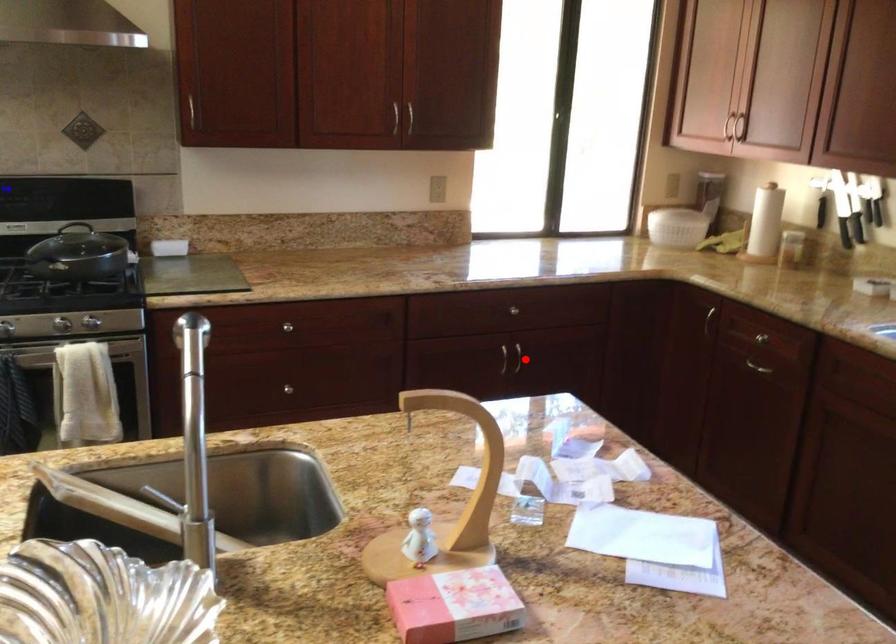
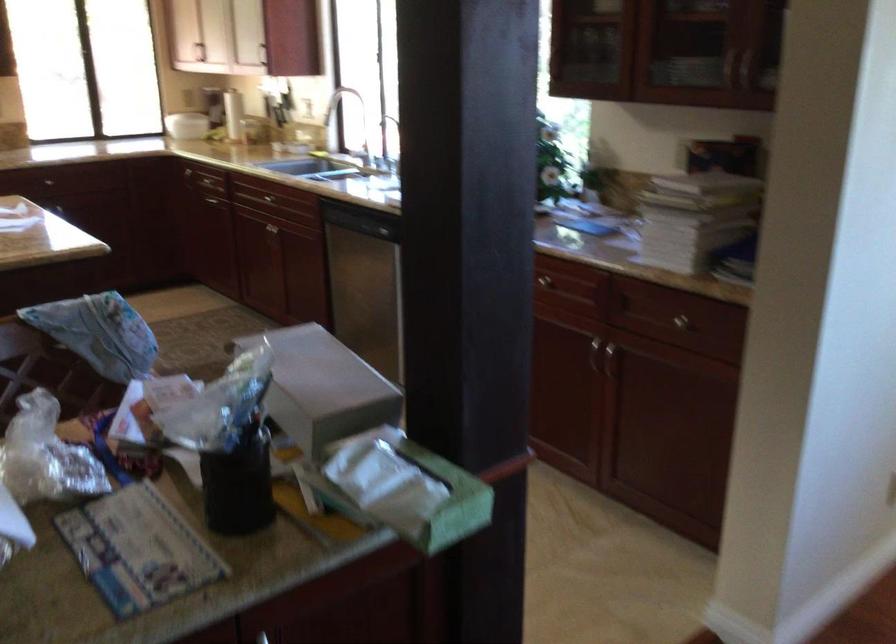
In the second image, find the point that corresponds to the highlighted location in the first image.

(65, 207)